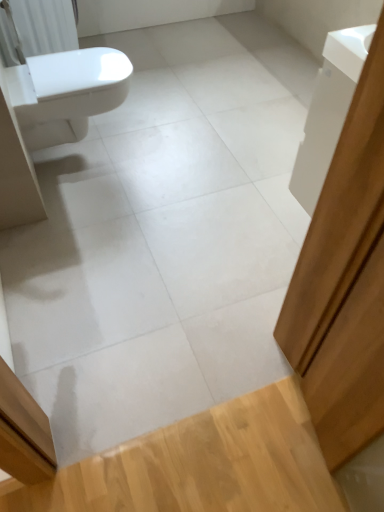
Identify the location of white glossy cabinet at upper right. (328, 110).

Describe the element at coordinates (201, 465) in the screenshot. The image size is (384, 512). I see `light wood floor at lower right` at that location.

Find the location of a particular element. white glossy cabinet at upper right is located at coordinates (328, 110).

Is white glossy bidet at left spatially inside light wood floor at lower right, or outside of it?

white glossy bidet at left is not enclosed by light wood floor at lower right.

Is white glossy bidet at left facing away from light wood floor at lower right?

No, white glossy bidet at left is not facing away from light wood floor at lower right.

Image resolution: width=384 pixels, height=512 pixels. Identify the location of plank directly beneath the white glossy bidet at left (from a real-world perspective). (201, 465).

From the picture: Considering the relative positions of white glossy cabinet at upper right and white glossy bidet at left in the image provided, is white glossy cabinet at upper right behind white glossy bidet at left?

No, white glossy cabinet at upper right is closer to the viewer.

Based on the photo, measure the distance between white glossy cabinet at upper right and white glossy bidet at left.

1.07 meters.

Considering the relative sizes of white glossy cabinet at upper right and white glossy bidet at left in the image provided, is white glossy cabinet at upper right shorter than white glossy bidet at left?

In fact, white glossy cabinet at upper right may be taller than white glossy bidet at left.

From a real-world perspective, is light wood floor at lower right below white glossy cabinet at upper right?

Yes, from a real-world perspective, light wood floor at lower right is under white glossy cabinet at upper right.

Could you tell me if light wood floor at lower right is turned towards white glossy cabinet at upper right?

No, light wood floor at lower right does not turn towards white glossy cabinet at upper right.

Which is nearer, (42,502) or (338,135)?

The point (338,135) is in front.

Can you see light wood floor at lower right touching white glossy cabinet at upper right?

No, light wood floor at lower right is not with white glossy cabinet at upper right.

Which object is further away from the camera, white plastic radiator at upper left or white glossy cabinet at upper right?

Positioned behind is white plastic radiator at upper left.

In terms of width, does white plastic radiator at upper left look wider or thinner when compared to white glossy cabinet at upper right?

Considering their sizes, white plastic radiator at upper left looks broader than white glossy cabinet at upper right.

From the image's perspective, is white plastic radiator at upper left on white glossy cabinet at upper right?

Yes, from the image's perspective, white plastic radiator at upper left is on top of white glossy cabinet at upper right.

Between point (4, 29) and point (329, 61), which one is positioned in front?

The point (329, 61) is closer.

From the image's perspective, is white glossy bidet at left on white plastic radiator at upper left?

No.

How different are the orientations of white glossy bidet at left and white plastic radiator at upper left in degrees?

0.372 degrees separate the facing orientations of white glossy bidet at left and white plastic radiator at upper left.

Is white glossy bidet at left closer to camera compared to white plastic radiator at upper left?

Yes, white glossy bidet at left is in front of white plastic radiator at upper left.

Is white glossy bidet at left inside the boundaries of white plastic radiator at upper left, or outside?

white glossy bidet at left cannot be found inside white plastic radiator at upper left.

Is white plastic radiator at upper left looking in the opposite direction of light wood floor at lower right?

No, white plastic radiator at upper left is not facing away from light wood floor at lower right.

Is white plastic radiator at upper left shorter than light wood floor at lower right?

No.

From a real-world perspective, relative to light wood floor at lower right, is white plastic radiator at upper left vertically above or below?

In terms of real-world spatial position, white plastic radiator at upper left is above light wood floor at lower right.

Is white plastic radiator at upper left positioned far away from light wood floor at lower right?

Yes, white plastic radiator at upper left is far from light wood floor at lower right.

From the image's perspective, is light wood floor at lower right beneath white glossy bidet at left?

Yes.

Between light wood floor at lower right and white glossy bidet at left, which one has larger width?

With larger width is white glossy bidet at left.

Is light wood floor at lower right aimed at white glossy bidet at left?

No, light wood floor at lower right is not facing towards white glossy bidet at left.

How many degrees apart are the facing directions of light wood floor at lower right and white glossy bidet at left?

There is a 90.6-degree angle between the facing directions of light wood floor at lower right and white glossy bidet at left.

Find the location of a particular element. The height and width of the screenshot is (512, 384). bidet that is on the left side of light wood floor at lower right is located at coordinates (66, 93).

Locate an element on the screen. The image size is (384, 512). cabinetry in front of the white glossy bidet at left is located at coordinates (328, 110).

Based on their spatial positions, is white plastic radiator at upper left or light wood floor at lower right closer to white glossy bidet at left?

white plastic radiator at upper left lies closer to white glossy bidet at left than the other object.

Considering their positions, is white glossy cabinet at upper right positioned further to light wood floor at lower right than white plastic radiator at upper left?

Among the two, white plastic radiator at upper left is located further to light wood floor at lower right.

When comparing their distances from white plastic radiator at upper left, does light wood floor at lower right or white glossy cabinet at upper right seem further?

light wood floor at lower right.

Looking at this image, estimate the real-world distances between objects in this image. Which object is further from white glossy cabinet at upper right, light wood floor at lower right or white glossy bidet at left?

Based on the image, white glossy bidet at left appears to be further to white glossy cabinet at upper right.

Looking at the image, which one is located further to white plastic radiator at upper left, white glossy cabinet at upper right or light wood floor at lower right?

Among the two, light wood floor at lower right is located further to white plastic radiator at upper left.

Looking at the image, which one is located closer to white glossy bidet at left, white glossy cabinet at upper right or light wood floor at lower right?

Based on the image, white glossy cabinet at upper right appears to be nearer to white glossy bidet at left.

Estimate the real-world distances between objects in this image. Which object is closer to white plastic radiator at upper left, white glossy cabinet at upper right or white glossy bidet at left?

white glossy bidet at left.

Considering their positions, is white glossy bidet at left positioned closer to light wood floor at lower right than white glossy cabinet at upper right?

white glossy cabinet at upper right is positioned closer to the anchor light wood floor at lower right.

Where is `bidet between white plastic radiator at upper left and light wood floor at lower right in the up-down direction`? bidet between white plastic radiator at upper left and light wood floor at lower right in the up-down direction is located at coordinates (66, 93).

Where is `bidet situated between white plastic radiator at upper left and white glossy cabinet at upper right from left to right`? This screenshot has height=512, width=384. bidet situated between white plastic radiator at upper left and white glossy cabinet at upper right from left to right is located at coordinates (66, 93).

The height and width of the screenshot is (512, 384). What are the coordinates of `cabinetry between white plastic radiator at upper left and light wood floor at lower right in the up-down direction` in the screenshot? It's located at (328, 110).

In order to click on cabinetry that lies between white glossy bidet at left and light wood floor at lower right from top to bottom in this screenshot , I will do `click(328, 110)`.